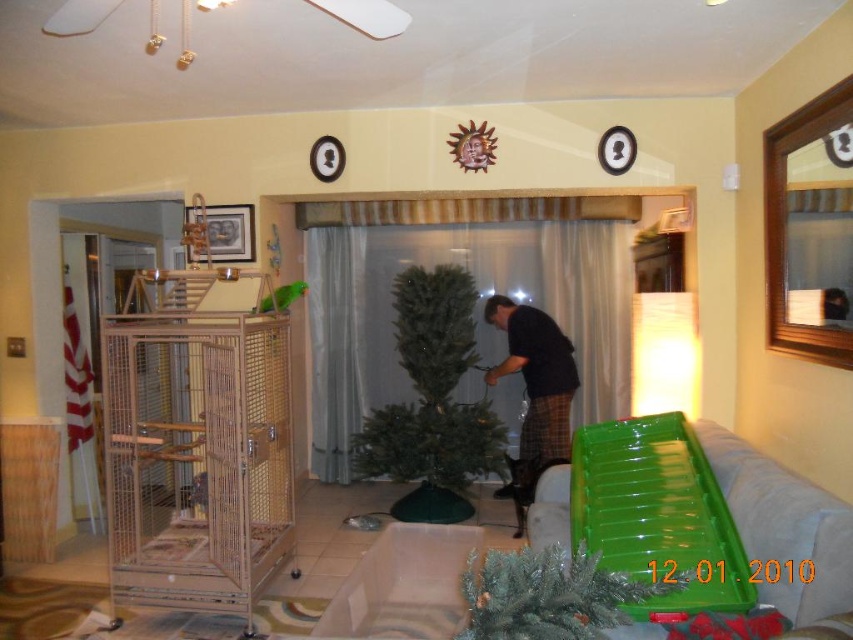
You are a guest entering the living room and want to place a small gift under the green matte christmas tree at center. However, you notice the metal mesh birdcage at left. Is the birdcage in the way of placing the gift under the tree?

The metal mesh birdcage at left is below the green matte christmas tree at center, meaning it is positioned lower and possibly closer to the base of the tree. This placement might block access to the area directly under the tree, making it difficult to place the gift there without moving the birdcage.

You are standing in the living room and want to place a gift under the artificial Christmas tree in the center. The gift is too heavy to lift, so you need to roll it across the floor. There is a point at coordinates (196, 458). Is this point a safe path to roll the gift towards the tree without hitting the metal mesh birdcage at left?

The point at (196, 458) is where the metal mesh birdcage at left is located, so rolling the gift over this point would hit the birdcage. Choose a different path.